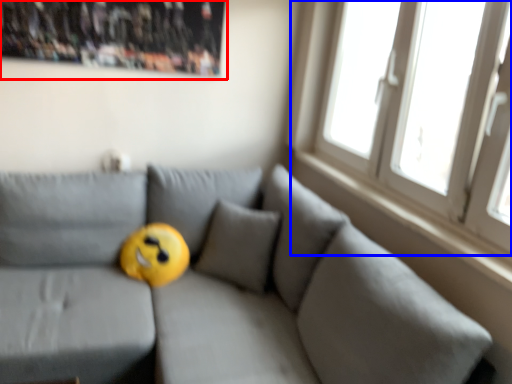
Question: Which object appears closest to the camera in this image, bulletin board (highlighted by a red box) or window (highlighted by a blue box)?

Choices:
 (A) bulletin board
 (B) window

Answer: (B)